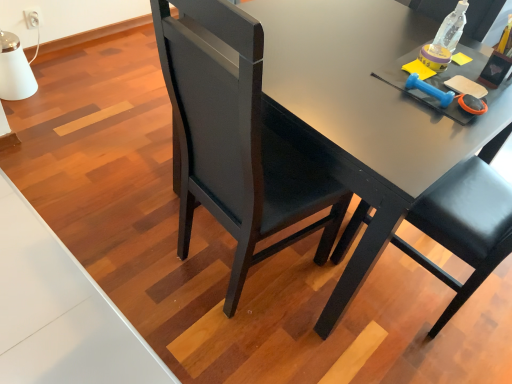
Where is `free space in front of clear plastic bottle at upper right`? Image resolution: width=512 pixels, height=384 pixels. free space in front of clear plastic bottle at upper right is located at coordinates (441, 75).